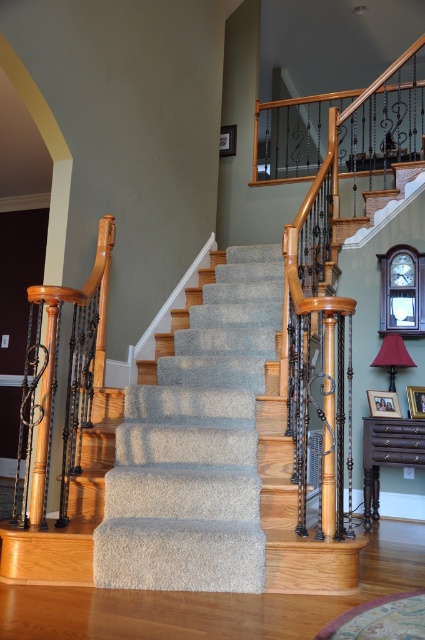
Does carpeted stairs at center have a lesser width compared to matte red lampshade at right?

No.

At what (x,y) coordinates should I click in order to perform the action: click on carpeted stairs at center. Please return your answer as a coordinate pair (x, y). Image resolution: width=425 pixels, height=640 pixels. Looking at the image, I should click on (209, 452).